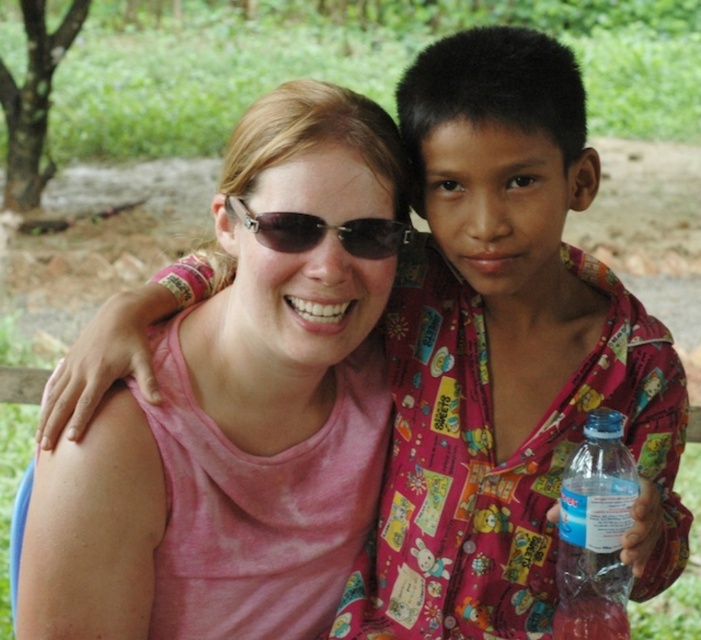
Question: In this image, where is clear plastic bottle at lower right located relative to matte black sunglasses at center?

Choices:
 (A) left
 (B) right

Answer: (B)

Question: Can you confirm if clear plastic bottle at lower right is positioned to the right of matte black sunglasses at center?

Choices:
 (A) no
 (B) yes

Answer: (B)

Question: Can you confirm if clear plastic bottle at lower right is positioned to the left of matte black sunglasses at center?

Choices:
 (A) no
 (B) yes

Answer: (A)

Question: Which point is farther to the camera?

Choices:
 (A) matte black sunglasses at center
 (B) clear plastic bottle at lower right

Answer: (A)

Question: Which object is closer to the camera taking this photo?

Choices:
 (A) clear plastic bottle at lower right
 (B) matte black sunglasses at center

Answer: (A)